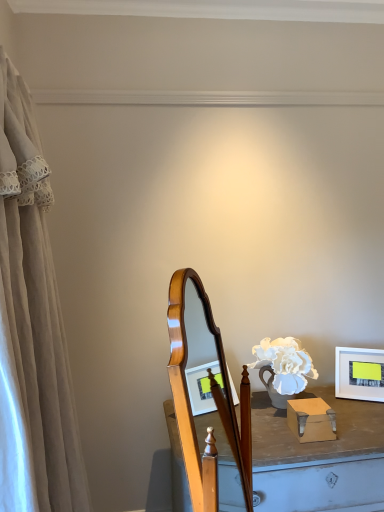
Question: Is point (336, 361) positioned closer to the camera than point (46, 271)?

Choices:
 (A) farther
 (B) closer

Answer: (A)

Question: Is white matte picture frame at right inside or outside of beige fabric curtain at left?

Choices:
 (A) inside
 (B) outside

Answer: (B)

Question: From their relative heights in the image, would you say white matte picture frame at right is taller or shorter than beige fabric curtain at left?

Choices:
 (A) short
 (B) tall

Answer: (A)

Question: Is point (3, 278) positioned closer to the camera than point (357, 371)?

Choices:
 (A) farther
 (B) closer

Answer: (B)

Question: Visually, is beige fabric curtain at left positioned to the left or to the right of white matte picture frame at right?

Choices:
 (A) left
 (B) right

Answer: (A)

Question: Is beige fabric curtain at left wider or thinner than white matte picture frame at right?

Choices:
 (A) wide
 (B) thin

Answer: (A)

Question: Do you think beige fabric curtain at left is within white matte picture frame at right, or outside of it?

Choices:
 (A) inside
 (B) outside

Answer: (B)